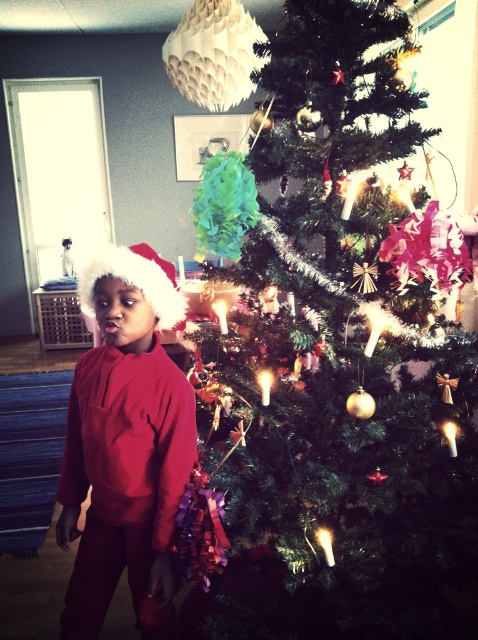
Question: Is green shiny christmas tree at center above fuzzy fabric santa hat at left?

Choices:
 (A) yes
 (B) no

Answer: (B)

Question: Among these objects, which one is nearest to the camera?

Choices:
 (A) matte red sweater at center
 (B) fuzzy fabric santa hat at left
 (C) green shiny christmas tree at center

Answer: (C)

Question: Which point is closer to the camera?

Choices:
 (A) (133, 272)
 (B) (364, 611)
 (C) (143, 252)

Answer: (A)

Question: Among these objects, which one is farthest from the camera?

Choices:
 (A) matte red sweater at center
 (B) green shiny christmas tree at center
 (C) fuzzy fabric santa hat at left

Answer: (C)

Question: Is matte red sweater at center wider than fuzzy fabric santa hat at left?

Choices:
 (A) no
 (B) yes

Answer: (B)

Question: Is matte red sweater at center bigger than fuzzy fabric santa hat at left?

Choices:
 (A) no
 (B) yes

Answer: (B)